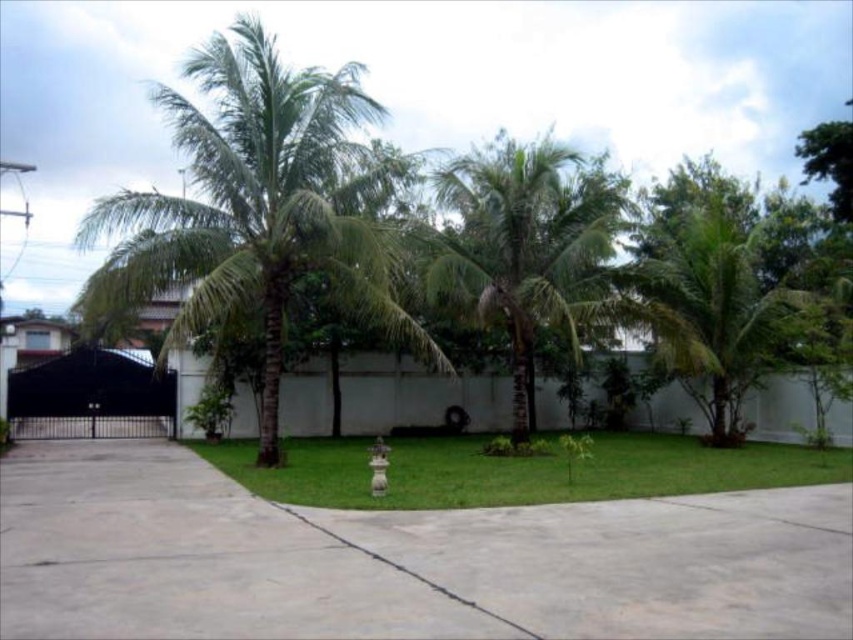
Question: Is green grass at center above green leafy palm tree at right?

Choices:
 (A) yes
 (B) no

Answer: (B)

Question: Estimate the real-world distances between objects in this image. Which object is farther from the green leafy palm tree at right?

Choices:
 (A) green grass at center
 (B) gray concrete pavement at center
 (C) green leafy coconut tree at center

Answer: (B)

Question: Does gray concrete pavement at center have a smaller size compared to green grass at center?

Choices:
 (A) yes
 (B) no

Answer: (A)

Question: Considering the relative positions of gray concrete pavement at center and green leafy palm tree at center in the image provided, where is gray concrete pavement at center located with respect to green leafy palm tree at center?

Choices:
 (A) left
 (B) right

Answer: (A)

Question: Which object is closer to the camera taking this photo?

Choices:
 (A) green grass at center
 (B) green leafy palm tree at center
 (C) green leafy palm tree at right
 (D) gray concrete pavement at center

Answer: (D)

Question: Estimate the real-world distances between objects in this image. Which object is closer to the gray concrete pavement at center?

Choices:
 (A) green leafy palm tree at center
 (B) green leafy coconut tree at center
 (C) green leafy palm tree at right
 (D) green grass at center

Answer: (D)